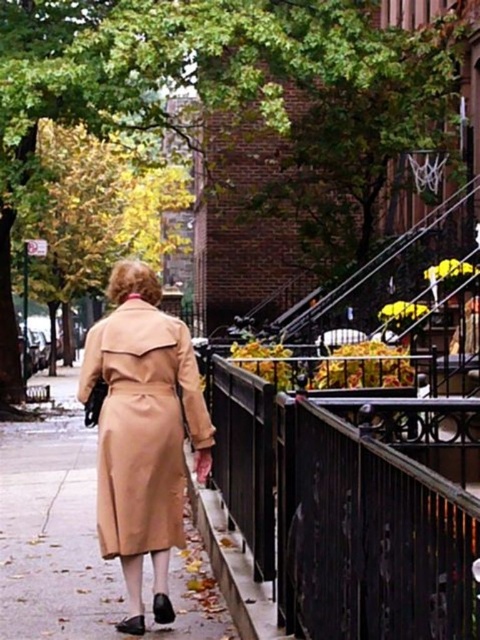
Which is in front, point (340, 406) or point (182, 445)?

Point (340, 406)

Is point (332, 636) positioned before point (139, 464)?

Yes, point (332, 636) is in front of point (139, 464).

Identify the location of black wrought iron railing at center. The image size is (480, 640). (351, 506).